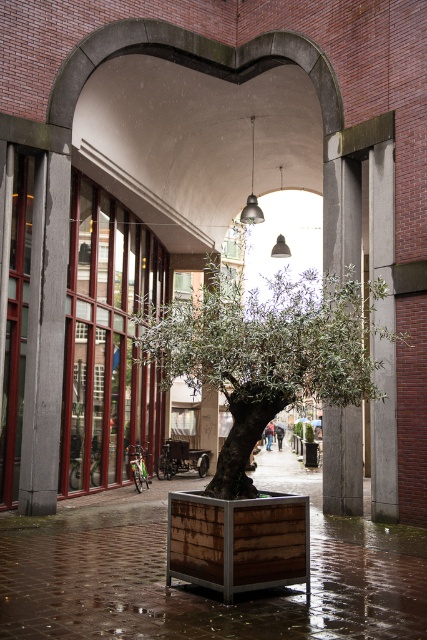
You are a visitor standing under the heart archway and see the green leafy tree at center and the wooden planter at center. Which object is closer to you?

The green leafy tree at center is closer to you because it is in front of the wooden planter at center.

You are standing at the center of the heart archway and want to place a new bench. The current green leafy tree at center is located at coordinates 0.550, 0.628. If the bench requires 0.3 meters of space around it, will there be enough room to place it without disturbing the tree?

The green leafy tree at center is positioned at coordinates (268, 352). Since the bench requires 0.3 meters of space around it, there should be sufficient room to place the bench without disturbing the tree, provided the bench is placed at a safe distance from the tree.

You are a city planner assessing the space under the archway. You need to install a new light fixture that must be placed above the green leafy tree at center and wooden planter at center. Considering their heights, which object requires the light fixture to be installed higher?

The green leafy tree at center has a greater height compared to wooden planter at center, so the light fixture needs to be installed higher above the green leafy tree at center to accommodate its height.